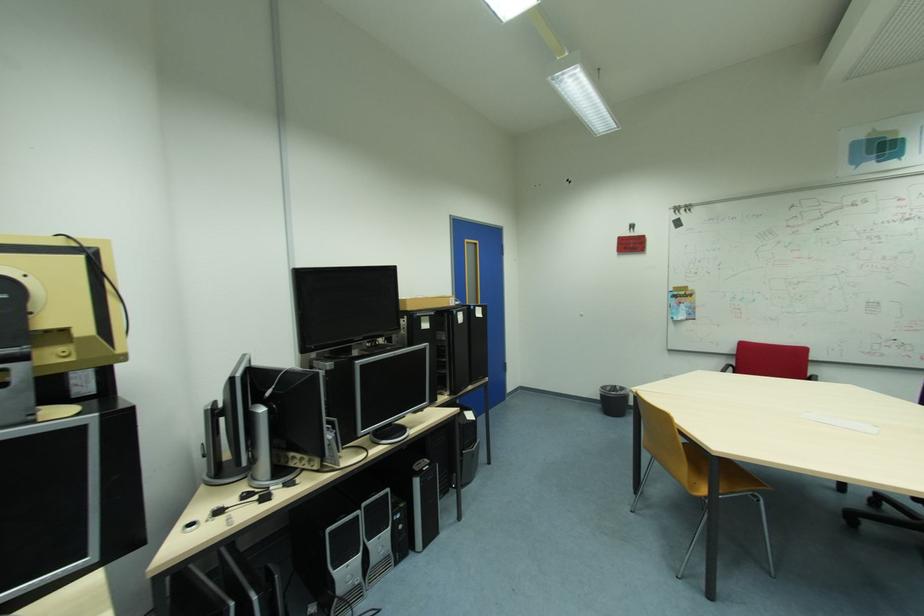
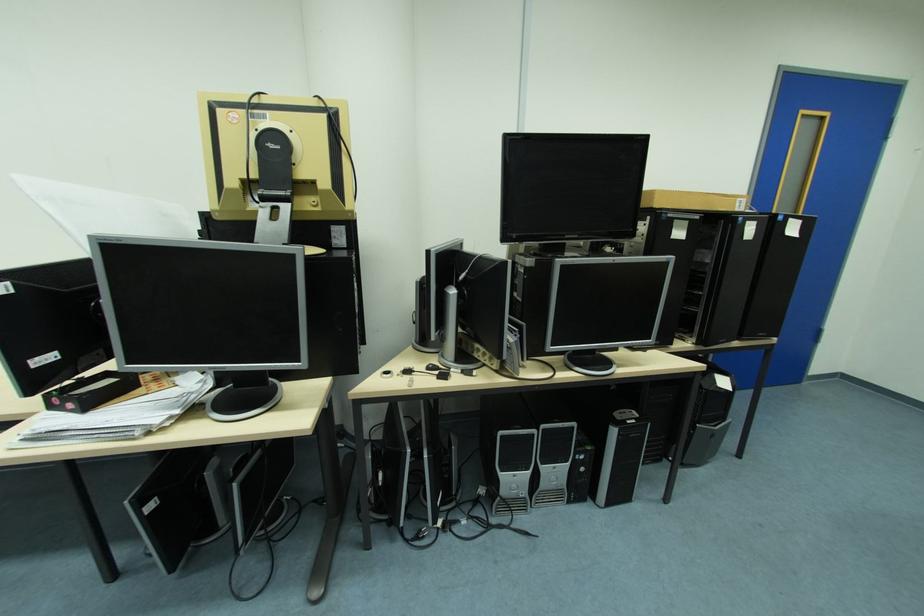
In the second image, find the point that corresponds to (335,530) in the first image.

(507, 434)